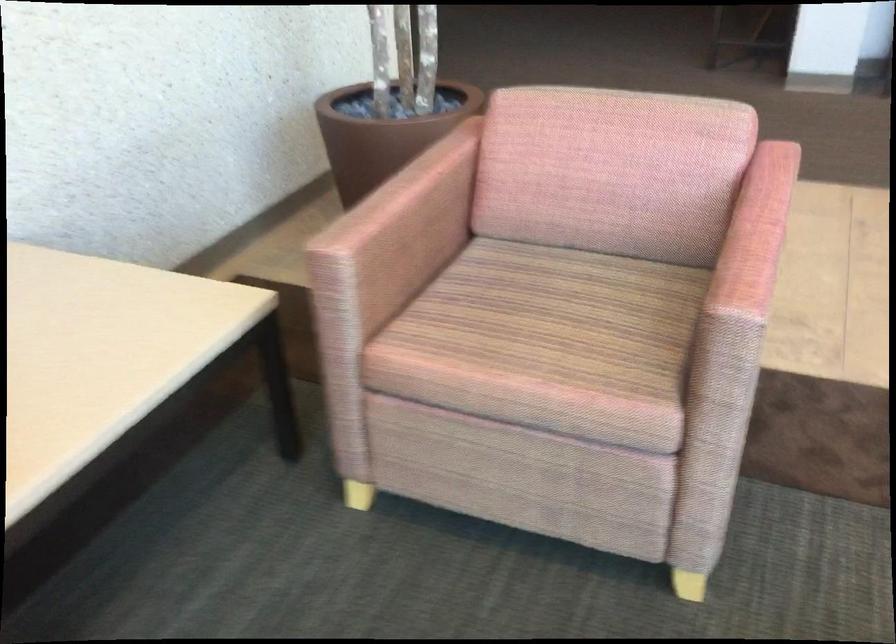
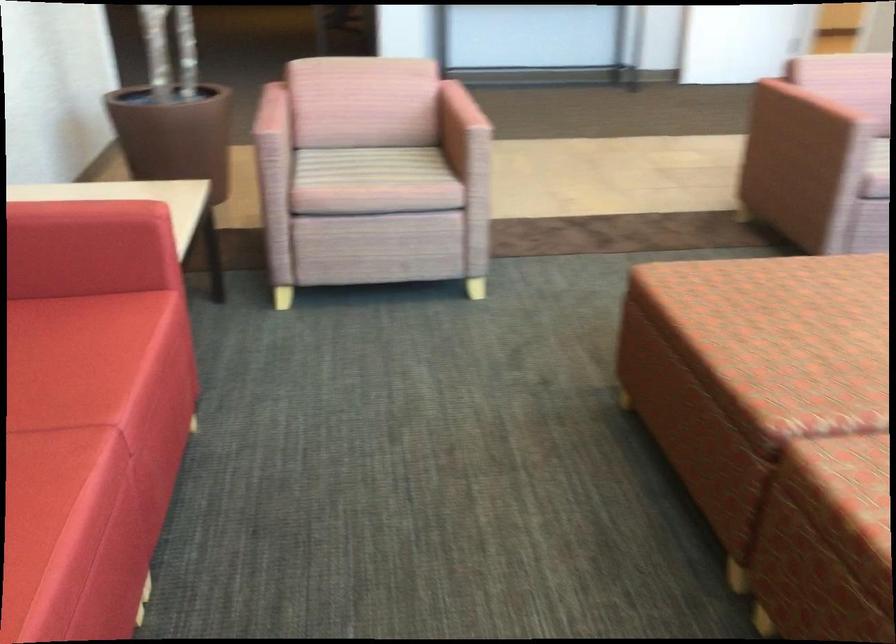
In the second image, find the point that corresponds to point 383,205 in the first image.

(271, 113)